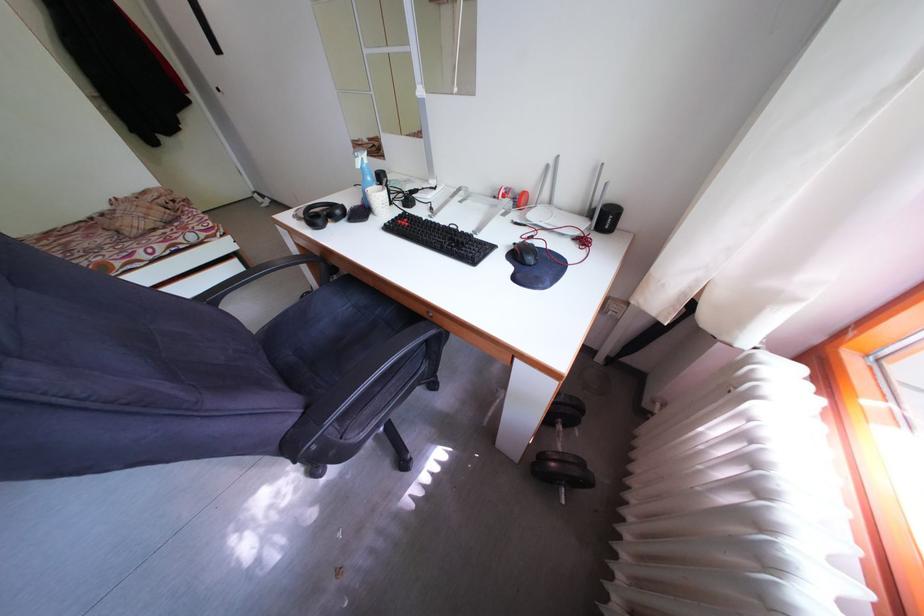
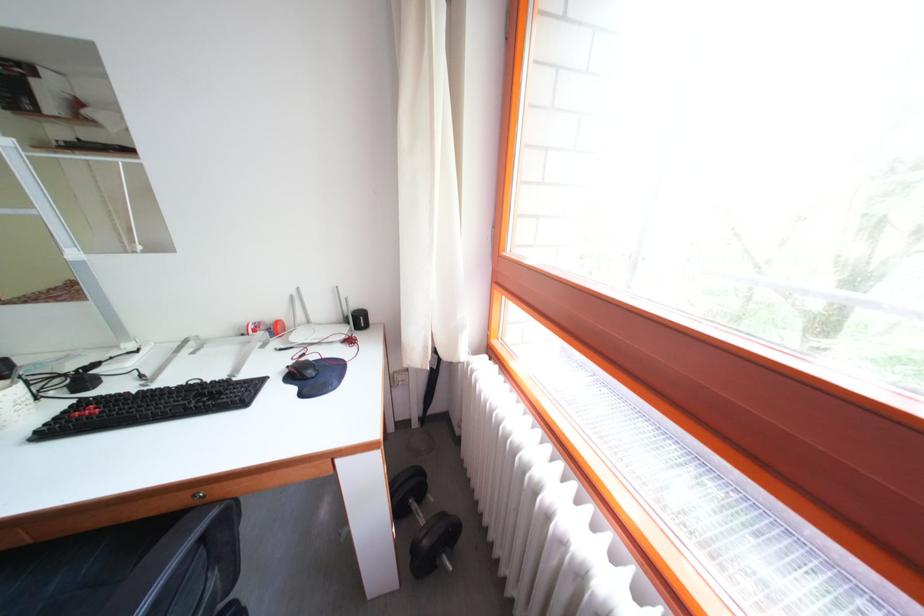
Locate, in the second image, the point that corresponds to (x=527, y=246) in the first image.

(298, 370)